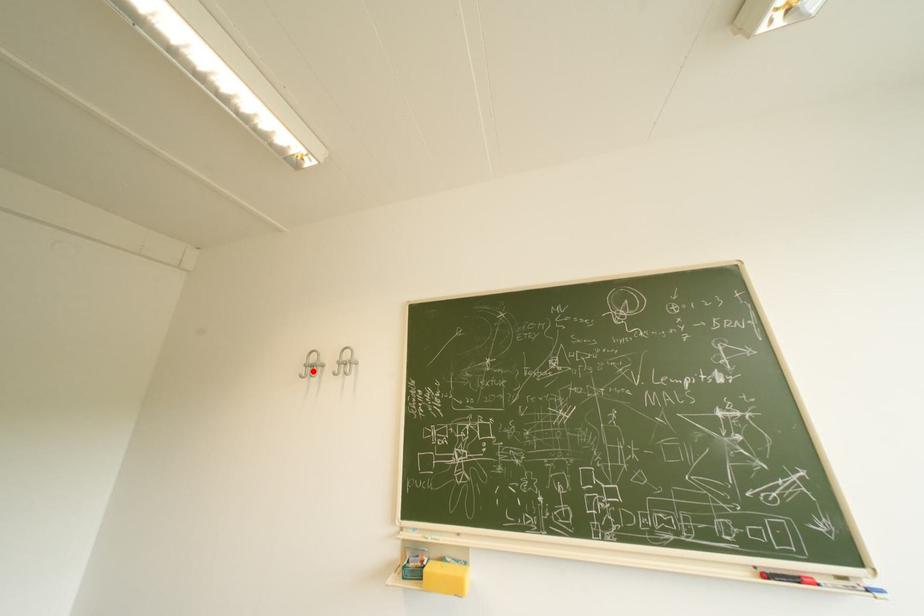
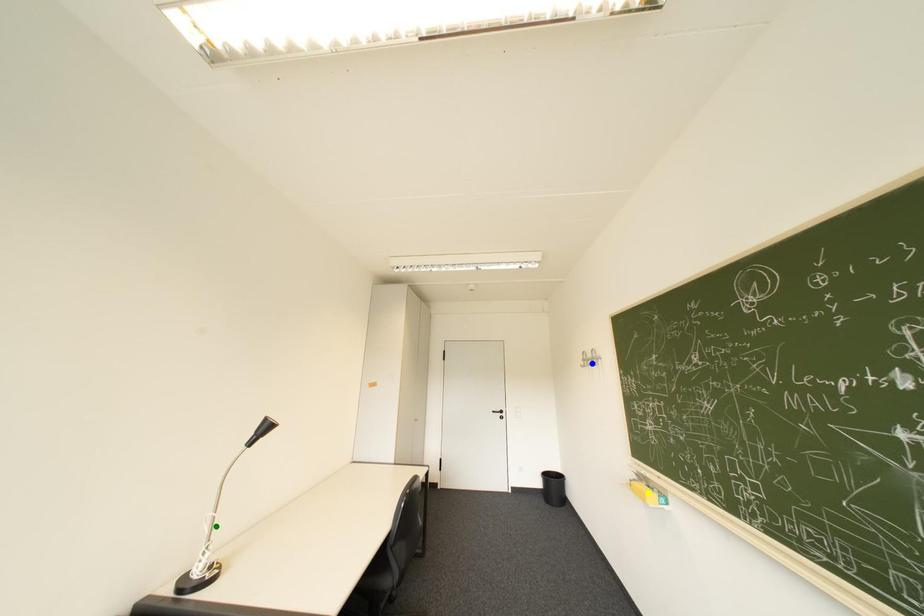
Question: I am providing you with two images of the same scene from different viewpoints. A red point is marked on the first image. You are given multiple points on the second image. Which spot in image 2 lines up with the point in image 1?

Choices:
 (A) blue point
 (B) yellow point
 (C) green point

Answer: (A)